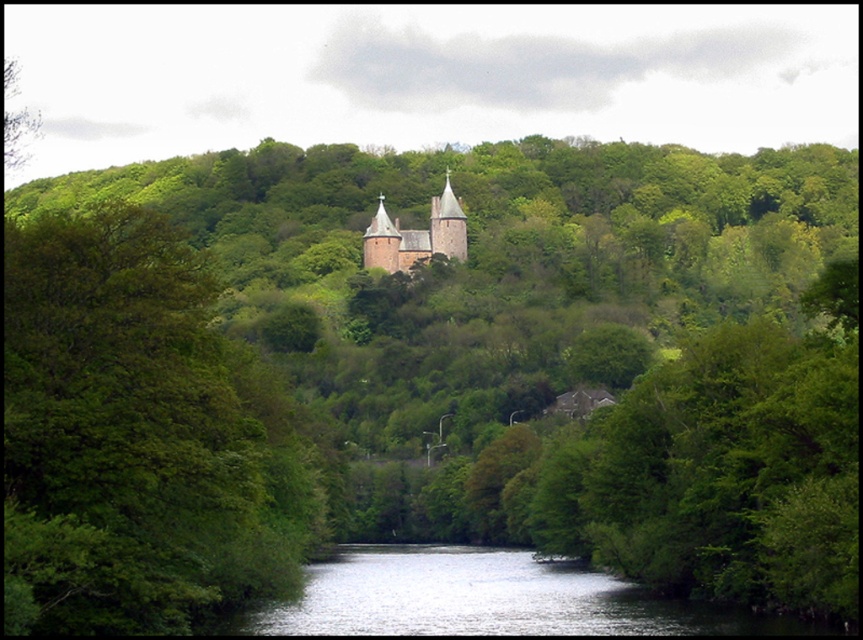
Can you confirm if green leafy tree at center is positioned to the left of smooth stone church at center?

Yes, green leafy tree at center is to the left of smooth stone church at center.

Where is `green leafy tree at center`? The width and height of the screenshot is (863, 640). green leafy tree at center is located at coordinates pyautogui.click(x=139, y=436).